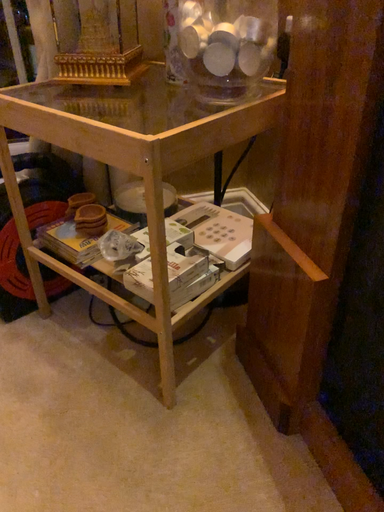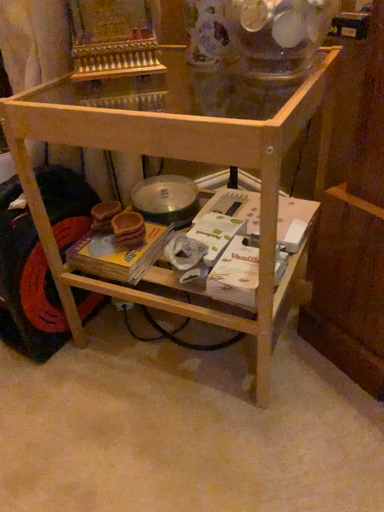
Question: Which way did the camera rotate in the video?

Choices:
 (A) rotated left
 (B) rotated right

Answer: (B)